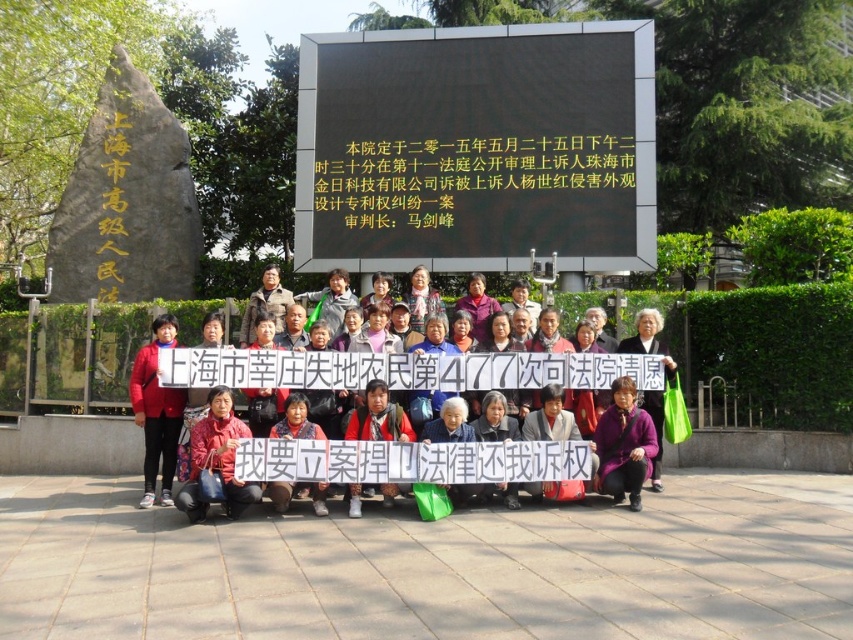
Who is more forward, (546, 230) or (154, 328)?

Point (154, 328) is more forward.

The width and height of the screenshot is (853, 640). What are the coordinates of `black matte sign at upper center` in the screenshot? It's located at 476,147.

Locate an element on the screen. black matte sign at upper center is located at coordinates (476, 147).

Who is lower down, yellow text on digital screen at upper center or red fabric jacket at lower center?

Positioned lower is red fabric jacket at lower center.

Can you confirm if yellow text on digital screen at upper center is positioned to the right of red fabric jacket at lower center?

Indeed, yellow text on digital screen at upper center is positioned on the right side of red fabric jacket at lower center.

This screenshot has width=853, height=640. Describe the element at coordinates (460, 173) in the screenshot. I see `yellow text on digital screen at upper center` at that location.

Where is `yellow text on digital screen at upper center`? The height and width of the screenshot is (640, 853). yellow text on digital screen at upper center is located at coordinates (460, 173).

Between red matte jacket at center and purple matte jacket at lower center, which one appears on the right side from the viewer's perspective?

Positioned to the right is purple matte jacket at lower center.

Locate an element on the screen. red matte jacket at center is located at coordinates (155, 412).